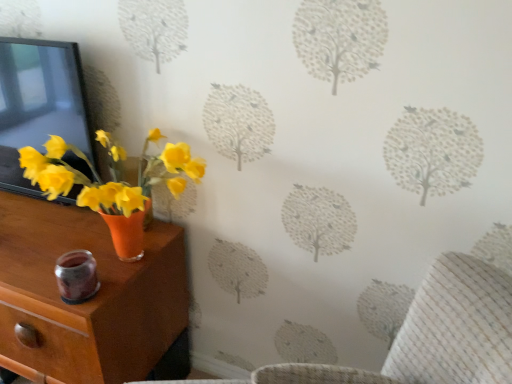
Question: From the image's perspective, relative to matte black picture frame at left, is orange matte vase at left above or below?

Choices:
 (A) above
 (B) below

Answer: (B)

Question: In the image, is orange matte vase at left on the left side or the right side of matte black picture frame at left?

Choices:
 (A) left
 (B) right

Answer: (A)

Question: Which is correct: orange matte vase at left is inside matte black picture frame at left, or outside of it?

Choices:
 (A) inside
 (B) outside

Answer: (B)

Question: Considering the positions of point (62, 61) and point (148, 271), is point (62, 61) closer or farther from the camera than point (148, 271)?

Choices:
 (A) closer
 (B) farther

Answer: (A)

Question: Looking at their shapes, would you say matte black picture frame at left is wider or thinner than orange matte vase at left?

Choices:
 (A) wide
 (B) thin

Answer: (B)

Question: In terms of height, does matte black picture frame at left look taller or shorter compared to orange matte vase at left?

Choices:
 (A) short
 (B) tall

Answer: (A)

Question: Is matte black picture frame at left situated inside orange matte vase at left or outside?

Choices:
 (A) outside
 (B) inside

Answer: (A)